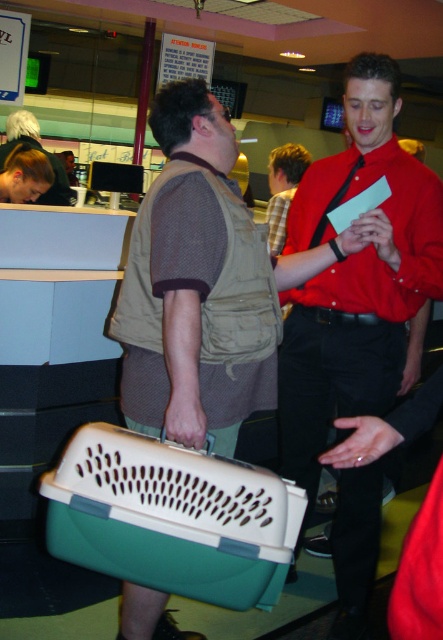
Measure the distance from matte plastic pet carrier at lower left to matte brown vest at center.

matte plastic pet carrier at lower left and matte brown vest at center are 7.57 feet apart.

Who is taller, matte plastic pet carrier at lower left or matte brown vest at center?

With more height is matte plastic pet carrier at lower left.

Is point (209, 372) in front of point (7, 138)?

Yes.

Find the location of `matte plastic pet carrier at lower left`. matte plastic pet carrier at lower left is located at coordinates (197, 285).

Can you confirm if matte black shirt at center is positioned above matte brown vest at center?

Actually, matte black shirt at center is below matte brown vest at center.

Which is above, matte black shirt at center or matte brown vest at center?

Positioned higher is matte brown vest at center.

At what (x,y) coordinates should I click in order to perform the action: click on matte black shirt at center. Please return your answer as a coordinate pair (x, y). This screenshot has height=640, width=443. Looking at the image, I should click on (356, 275).

Which is below, matte black shirt at center or matte plastic pet carrier at lower left?

matte black shirt at center

Between matte black shirt at center and matte plastic pet carrier at lower left, which one is positioned higher?

matte plastic pet carrier at lower left

What do you see at coordinates (356, 275) in the screenshot? This screenshot has height=640, width=443. I see `matte black shirt at center` at bounding box center [356, 275].

The image size is (443, 640). I want to click on matte black shirt at center, so click(x=356, y=275).